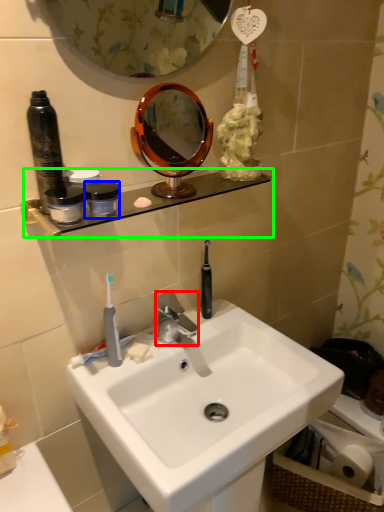
Question: Which object is the closest to the faucet (highlighted by a red box)? Choose among these: coffee cup (highlighted by a blue box) or shelve (highlighted by a green box).

Choices:
 (A) coffee cup
 (B) shelve

Answer: (B)